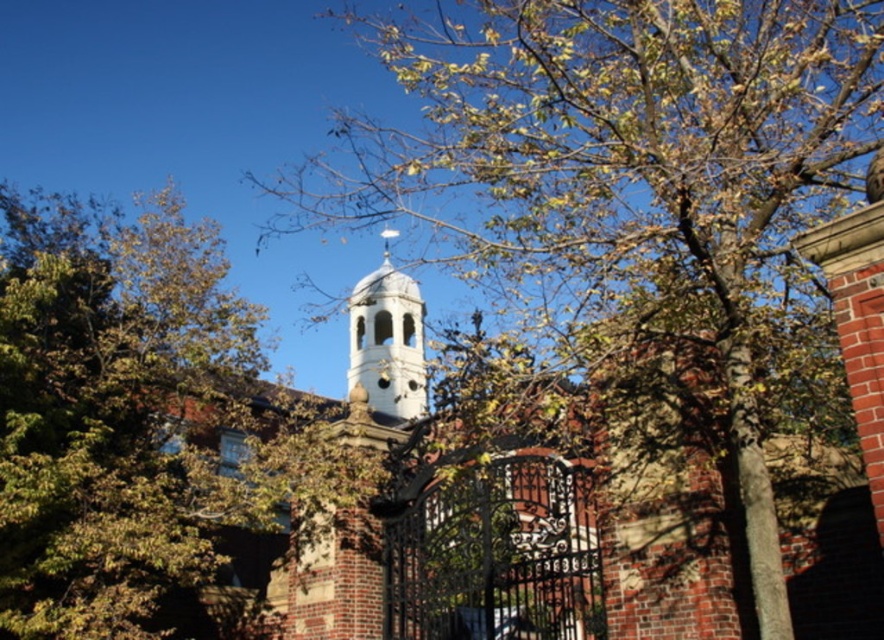
Question: Which object is the closest to the green leafy tree at upper center?

Choices:
 (A) white stone bell tower at center
 (B) brown leafy tree at center

Answer: (B)

Question: Estimate the real-world distances between objects in this image. Which object is farther from the brown leafy tree at center?

Choices:
 (A) green leafy tree at upper center
 (B) white stone bell tower at center

Answer: (B)

Question: Can you confirm if green leafy tree at upper center is positioned to the right of white stone bell tower at center?

Choices:
 (A) yes
 (B) no

Answer: (B)

Question: Which of the following is the farthest from the observer?

Choices:
 (A) (410, 324)
 (B) (446, 115)

Answer: (A)

Question: Is brown leafy tree at center thinner than white stone bell tower at center?

Choices:
 (A) no
 (B) yes

Answer: (A)

Question: Can you confirm if green leafy tree at upper center is smaller than white stone bell tower at center?

Choices:
 (A) yes
 (B) no

Answer: (B)